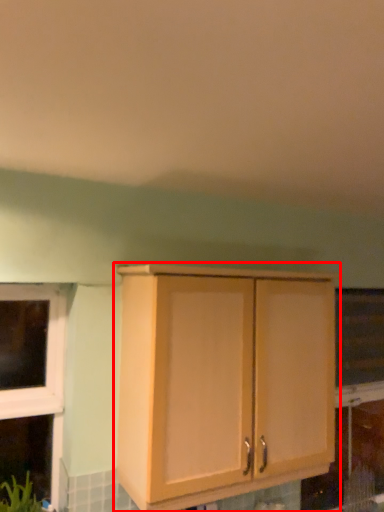
Question: Considering the relative positions of cabinetry (annotated by the red box) and window screen in the image provided, where is cabinetry (annotated by the red box) located with respect to the staircase?

Choices:
 (A) left
 (B) right

Answer: (A)